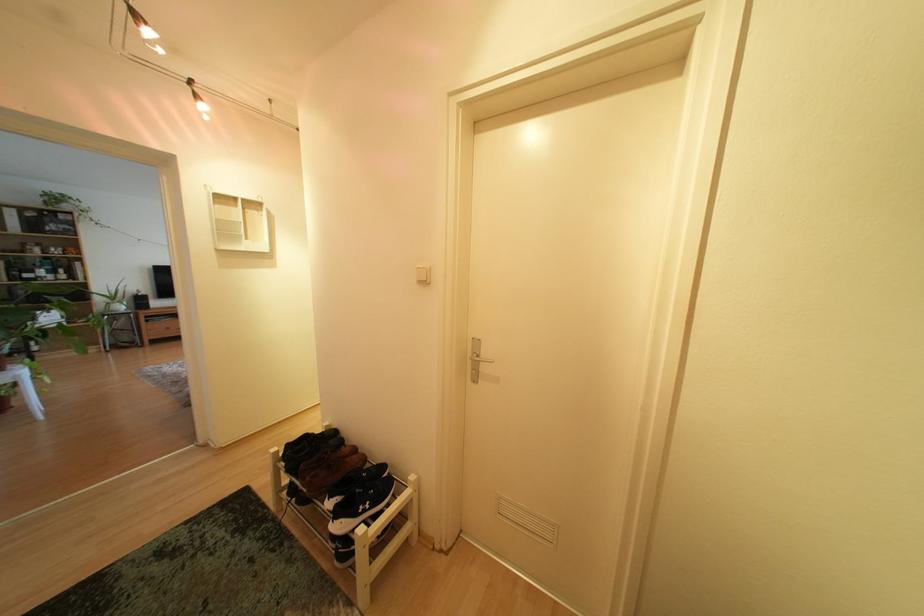
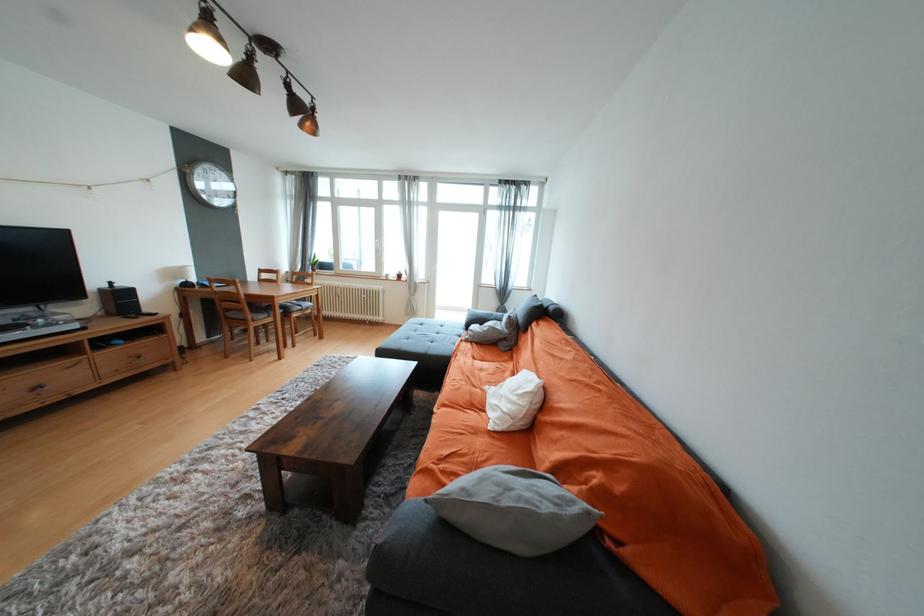
What movement of the cameraman would produce the second image?

The cameraman moved toward left, forward.